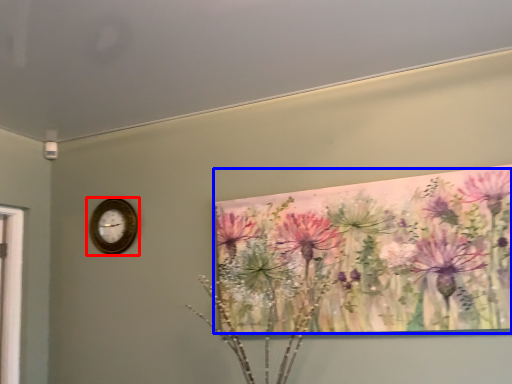
Question: Which of the following is the farthest to the observer, wall clock (highlighted by a red box) or flower (highlighted by a blue box)?

Choices:
 (A) wall clock
 (B) flower

Answer: (A)